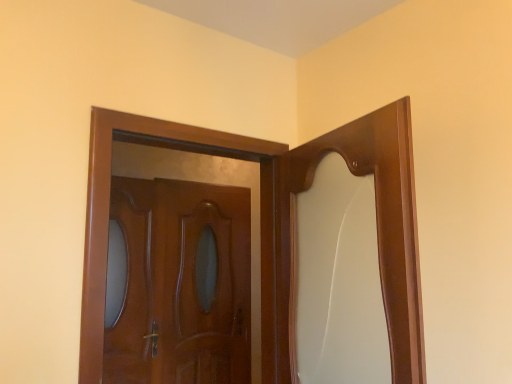
The height and width of the screenshot is (384, 512). Describe the element at coordinates (278, 225) in the screenshot. I see `glossy wood door at center, marked as the 1th door in a front-to-back arrangement` at that location.

Consider the image. Measure the distance between point (362, 142) and camera.

4.84 feet.

The width and height of the screenshot is (512, 384). I want to click on glossy wood door at center, marked as the 1th door in a front-to-back arrangement, so click(x=278, y=225).

Identify the location of glossy wood door at center, which is the second door from front to back. (181, 284).

The width and height of the screenshot is (512, 384). Describe the element at coordinates (181, 284) in the screenshot. I see `glossy wood door at center, which is the second door from front to back` at that location.

This screenshot has width=512, height=384. I want to click on glossy wood door at center, the 2th door positioned from the back, so click(x=278, y=225).

Which object is positioned more to the right, glossy wood door at center, marked as the 1th door in a front-to-back arrangement, or glossy wood door at center, which is the second door from front to back?

Positioned to the right is glossy wood door at center, marked as the 1th door in a front-to-back arrangement.

Is glossy wood door at center, marked as the 1th door in a front-to-back arrangement, further to camera compared to glossy wood door at center, which is the second door from front to back?

No.

Which is closer to the camera, (264, 256) or (132, 311)?

The point (264, 256) is more forward.

From the image's perspective, is glossy wood door at center, marked as the 1th door in a front-to-back arrangement, located above glossy wood door at center, which is counted as the 1th door, starting from the back?

Indeed, from the image's perspective, glossy wood door at center, marked as the 1th door in a front-to-back arrangement, is shown above glossy wood door at center, which is counted as the 1th door, starting from the back.

From a real-world perspective, which is physically above, glossy wood door at center, the 2th door positioned from the back, or glossy wood door at center, which is the second door from front to back?

From a 3D spatial view, glossy wood door at center, the 2th door positioned from the back, is above.

Is glossy wood door at center, marked as the 1th door in a front-to-back arrangement, wider than glossy wood door at center, which is the second door from front to back?

Indeed, glossy wood door at center, marked as the 1th door in a front-to-back arrangement, has a greater width compared to glossy wood door at center, which is the second door from front to back.

Considering the relative sizes of glossy wood door at center, marked as the 1th door in a front-to-back arrangement, and glossy wood door at center, which is counted as the 1th door, starting from the back, in the image provided, is glossy wood door at center, marked as the 1th door in a front-to-back arrangement, shorter than glossy wood door at center, which is counted as the 1th door, starting from the back,?

Correct, glossy wood door at center, marked as the 1th door in a front-to-back arrangement, is not as tall as glossy wood door at center, which is counted as the 1th door, starting from the back.

Who is bigger, glossy wood door at center, the 2th door positioned from the back, or glossy wood door at center, which is counted as the 1th door, starting from the back?

glossy wood door at center, the 2th door positioned from the back, is bigger.

Is glossy wood door at center, which is counted as the 1th door, starting from the back, a part of glossy wood door at center, marked as the 1th door in a front-to-back arrangement?

A: No, glossy wood door at center, which is counted as the 1th door, starting from the back, is not surrounded by glossy wood door at center, marked as the 1th door in a front-to-back arrangement.

Can you see glossy wood door at center, marked as the 1th door in a front-to-back arrangement, touching glossy wood door at center, which is the second door from front to back?

No, glossy wood door at center, marked as the 1th door in a front-to-back arrangement, is not making contact with glossy wood door at center, which is the second door from front to back.

Is glossy wood door at center, marked as the 1th door in a front-to-back arrangement, aimed at glossy wood door at center, which is the second door from front to back?

No, glossy wood door at center, marked as the 1th door in a front-to-back arrangement, is not facing towards glossy wood door at center, which is the second door from front to back.

What's the angular difference between glossy wood door at center, marked as the 1th door in a front-to-back arrangement, and glossy wood door at center, which is the second door from front to back,'s facing directions?

glossy wood door at center, marked as the 1th door in a front-to-back arrangement, and glossy wood door at center, which is the second door from front to back, are facing 2.29 degrees away from each other.

Identify the location of door that appears below the glossy wood door at center, marked as the 1th door in a front-to-back arrangement (from a real-world perspective). This screenshot has width=512, height=384. (181, 284).

Visually, is glossy wood door at center, which is counted as the 1th door, starting from the back, positioned to the left or to the right of glossy wood door at center, marked as the 1th door in a front-to-back arrangement?

glossy wood door at center, which is counted as the 1th door, starting from the back, is positioned on glossy wood door at center, marked as the 1th door in a front-to-back arrangement,'s left side.

In the scene shown: In the image, is glossy wood door at center, which is counted as the 1th door, starting from the back, positioned in front of or behind glossy wood door at center, the 2th door positioned from the back?

glossy wood door at center, which is counted as the 1th door, starting from the back, is behind glossy wood door at center, the 2th door positioned from the back.

Which point is more forward, (170, 275) or (409, 289)?

The point (409, 289) is closer.

From the image's perspective, is glossy wood door at center, which is the second door from front to back, located above or below glossy wood door at center, marked as the 1th door in a front-to-back arrangement?

Based on their image positions, glossy wood door at center, which is the second door from front to back, is located beneath glossy wood door at center, marked as the 1th door in a front-to-back arrangement.

From a real-world perspective, does glossy wood door at center, which is counted as the 1th door, starting from the back, sit lower than glossy wood door at center, marked as the 1th door in a front-to-back arrangement?

Yes, from a real-world perspective, glossy wood door at center, which is counted as the 1th door, starting from the back, is under glossy wood door at center, marked as the 1th door in a front-to-back arrangement.

Can you confirm if glossy wood door at center, which is counted as the 1th door, starting from the back, is wider than glossy wood door at center, the 2th door positioned from the back?

Incorrect, the width of glossy wood door at center, which is counted as the 1th door, starting from the back, does not surpass that of glossy wood door at center, the 2th door positioned from the back.

Is glossy wood door at center, which is counted as the 1th door, starting from the back, taller or shorter than glossy wood door at center, marked as the 1th door in a front-to-back arrangement?

Clearly, glossy wood door at center, which is counted as the 1th door, starting from the back, is taller compared to glossy wood door at center, marked as the 1th door in a front-to-back arrangement.

From the picture: Considering the sizes of objects glossy wood door at center, which is the second door from front to back, and glossy wood door at center, the 2th door positioned from the back, in the image provided, who is smaller, glossy wood door at center, which is the second door from front to back, or glossy wood door at center, the 2th door positioned from the back,?

glossy wood door at center, which is the second door from front to back.

Is glossy wood door at center, which is the second door from front to back, outside of glossy wood door at center, marked as the 1th door in a front-to-back arrangement?

That's correct, glossy wood door at center, which is the second door from front to back, is outside of glossy wood door at center, marked as the 1th door in a front-to-back arrangement.

Is glossy wood door at center, which is counted as the 1th door, starting from the back, not near glossy wood door at center, marked as the 1th door in a front-to-back arrangement?

Yes, glossy wood door at center, which is counted as the 1th door, starting from the back, and glossy wood door at center, marked as the 1th door in a front-to-back arrangement, are quite far apart.

Looking at this image, is glossy wood door at center, which is counted as the 1th door, starting from the back, positioned with its back to glossy wood door at center, the 2th door positioned from the back?

No, glossy wood door at center, which is counted as the 1th door, starting from the back, is not facing away from glossy wood door at center, the 2th door positioned from the back.

Can you tell me how much glossy wood door at center, which is the second door from front to back, and glossy wood door at center, marked as the 1th door in a front-to-back arrangement, differ in facing direction?

The angle between the facing direction of glossy wood door at center, which is the second door from front to back, and the facing direction of glossy wood door at center, marked as the 1th door in a front-to-back arrangement, is 2.29 degrees.

Measure the distance between glossy wood door at center, which is counted as the 1th door, starting from the back, and glossy wood door at center, the 2th door positioned from the back.

A distance of 4.06 feet exists between glossy wood door at center, which is counted as the 1th door, starting from the back, and glossy wood door at center, the 2th door positioned from the back.

Image resolution: width=512 pixels, height=384 pixels. I want to click on door below the glossy wood door at center, the 2th door positioned from the back (from a real-world perspective), so click(x=181, y=284).

Find the location of a particular element. This screenshot has width=512, height=384. door located above the glossy wood door at center, which is counted as the 1th door, starting from the back (from the image's perspective) is located at coordinates (278, 225).

Locate an element on the screen. The image size is (512, 384). door that appears above the glossy wood door at center, which is the second door from front to back (from a real-world perspective) is located at coordinates (278, 225).